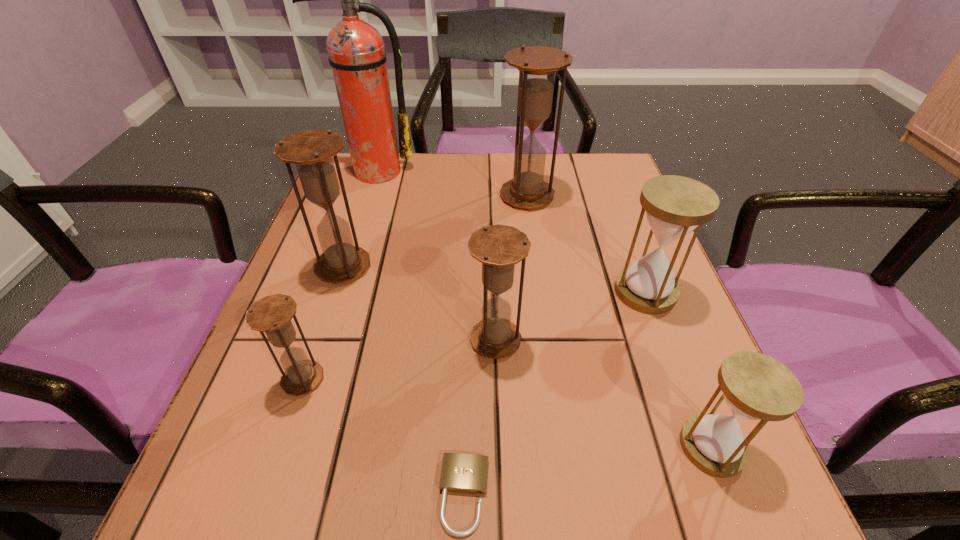
The height and width of the screenshot is (540, 960). Identify the location of free spot located on the back of the smaller white hourglass. (636, 249).

Where is `vacant space located on the back of the padlock`? Image resolution: width=960 pixels, height=540 pixels. vacant space located on the back of the padlock is located at coordinates (469, 261).

You are a GUI agent. You are given a task and a screenshot of the screen. Output one action in this format:
    pyautogui.click(x=<x>, y=<y>)
    Task: Click on the fire extinguisher that is at the far edge
    The height and width of the screenshot is (540, 960).
    Given the screenshot: What is the action you would take?
    pyautogui.click(x=356, y=52)

Locate an element on the screen. The width and height of the screenshot is (960, 540). hourglass that is at the far edge is located at coordinates (537, 66).

You are a GUI agent. You are given a task and a screenshot of the screen. Output one action in this format:
    pyautogui.click(x=<x>, y=<y>)
    Task: Click on the hourglass located in the near edge section of the desktop
    The image size is (960, 540).
    Given the screenshot: What is the action you would take?
    pyautogui.click(x=755, y=386)

The image size is (960, 540). Find the location of `padlock situated at the near edge`. padlock situated at the near edge is located at coordinates (463, 473).

Locate an element on the screen. The image size is (960, 540). fire extinguisher that is positioned at the left edge is located at coordinates 356,52.

The height and width of the screenshot is (540, 960). I want to click on object situated at the far left corner, so click(x=356, y=52).

Where is `object at the near right corner`? This screenshot has width=960, height=540. object at the near right corner is located at coordinates (755, 386).

Find the location of `vacant region at the far edge of the desktop`. vacant region at the far edge of the desktop is located at coordinates (551, 158).